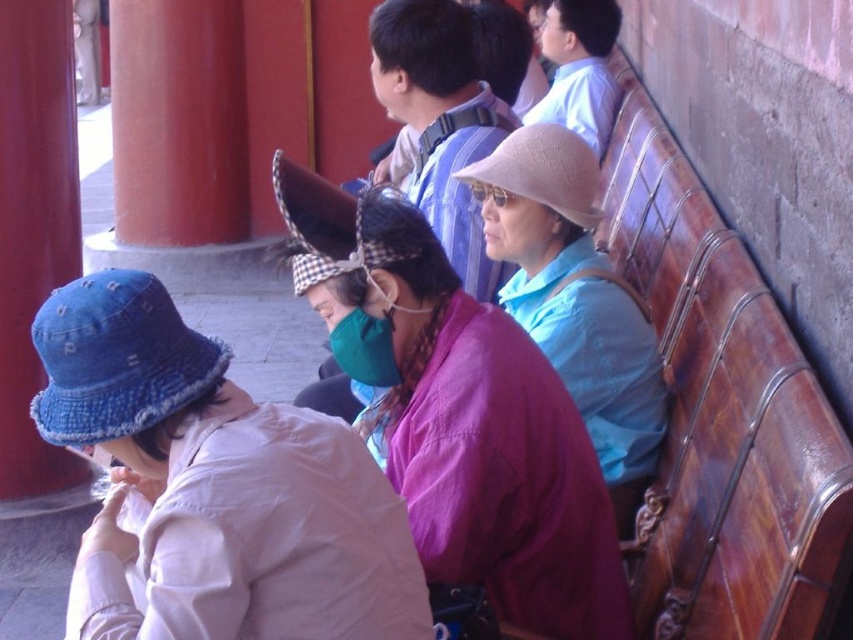
Question: From the image, what is the correct spatial relationship of purple fabric at center in relation to smooth red pillar at left?

Choices:
 (A) above
 (B) below

Answer: (B)

Question: Among these objects, which one is farthest from the camera?

Choices:
 (A) light beige straw hat at center
 (B) denim hat at lower left
 (C) purple fabric at center

Answer: (A)

Question: Does denim hat at lower left come behind light beige straw hat at center?

Choices:
 (A) no
 (B) yes

Answer: (A)

Question: Which point appears closest to the camera in this image?

Choices:
 (A) (422, 595)
 (B) (78, 243)
 (C) (467, 364)

Answer: (A)

Question: Can you confirm if light beige straw hat at center is positioned to the left of smooth red pillar at left?

Choices:
 (A) yes
 (B) no

Answer: (B)

Question: Based on their relative distances, which object is nearer to the smooth red pillar at left?

Choices:
 (A) light beige straw hat at center
 (B) denim hat at lower left
 (C) purple fabric at center

Answer: (A)